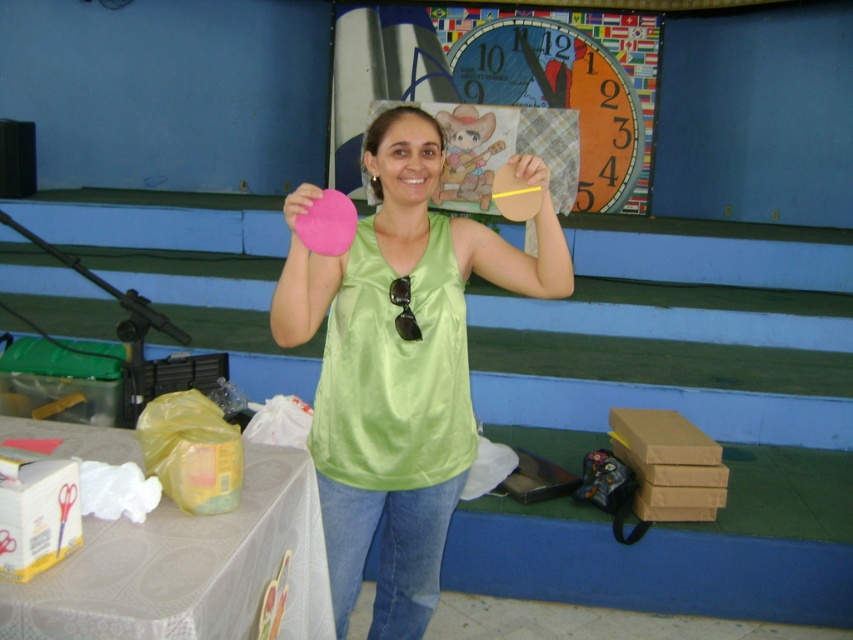
Does matte pink heart at center have a lesser height compared to white plastic table at lower left?

No.

Between matte pink heart at center and white plastic table at lower left, which one appears on the right side from the viewer's perspective?

matte pink heart at center

The width and height of the screenshot is (853, 640). Describe the element at coordinates (399, 365) in the screenshot. I see `matte pink heart at center` at that location.

This screenshot has height=640, width=853. Find the location of `matte pink heart at center`. matte pink heart at center is located at coordinates (399, 365).